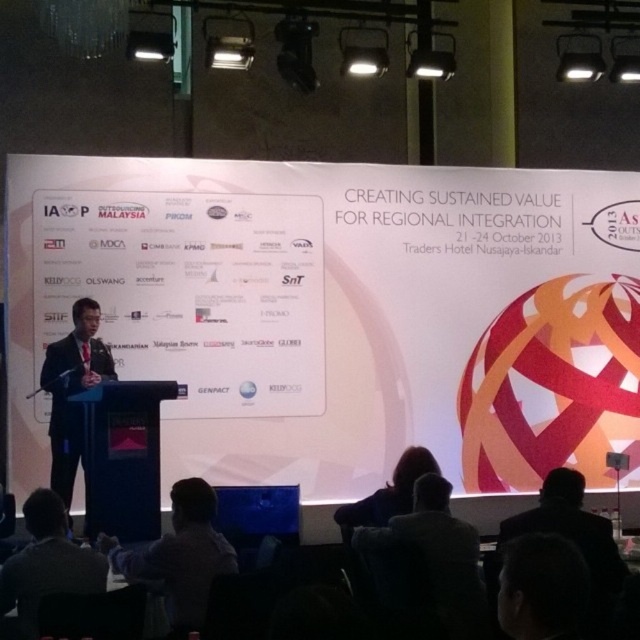
How distant is dark gray suit at lower left from black suit at left?

dark gray suit at lower left is 5.79 feet away from black suit at left.

Who is more distant from viewer, (38,548) or (54,348)?

Point (54,348)

Identify the location of dark gray suit at lower left. (45, 563).